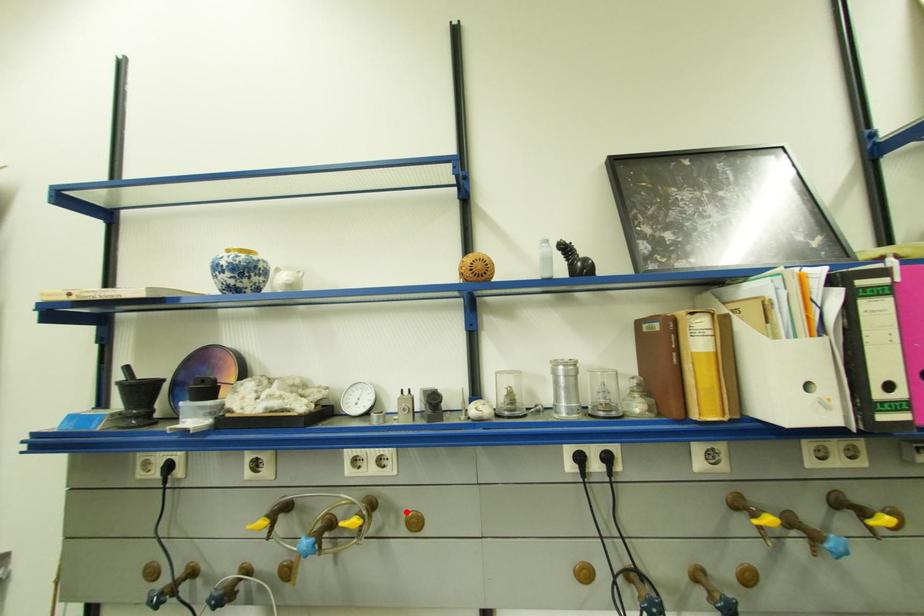
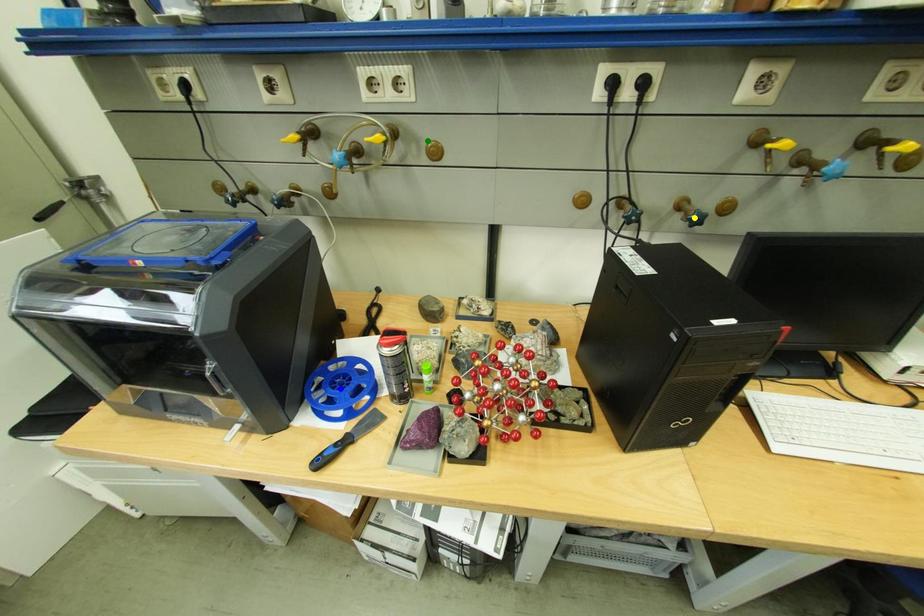
Question: I am providing you with two images of the same scene from different viewpoints. A red point is marked on the first image. You are given multiple points on the second image. Can you choose the point in image 2 that corresponds to the point in image 1?

Choices:
 (A) green point
 (B) blue point
 (C) yellow point

Answer: (A)